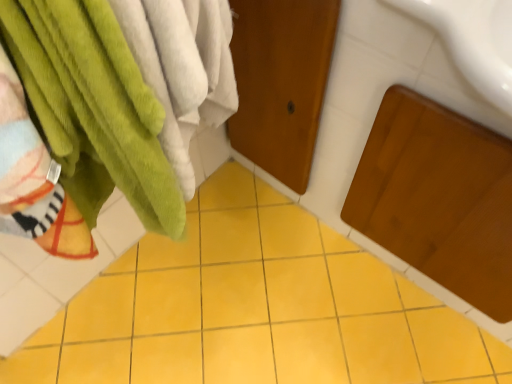
Measure the distance between yellow ceramic tile at center and camera.

A distance of 3.83 feet exists between yellow ceramic tile at center and camera.

What do you see at coordinates (255, 308) in the screenshot?
I see `yellow ceramic tile at center` at bounding box center [255, 308].

You are a GUI agent. You are given a task and a screenshot of the screen. Output one action in this format:
    pyautogui.click(x=<x>, y=<y>)
    Task: Click on the yellow ceramic tile at center
    Image resolution: width=512 pixels, height=384 pixels.
    Given the screenshot: What is the action you would take?
    pyautogui.click(x=255, y=308)

Locate an element on the screen. This screenshot has height=384, width=512. yellow ceramic tile at center is located at coordinates (255, 308).